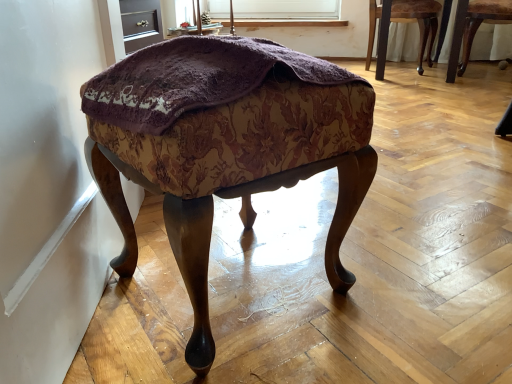
Question: Does wooden chair at upper right, the first chair viewed from the left, have a greater height compared to matte purple fabric at upper center?

Choices:
 (A) no
 (B) yes

Answer: (B)

Question: Considering the relative positions of wooden chair at upper right, the first chair viewed from the left, and matte purple fabric at upper center in the image provided, is wooden chair at upper right, the first chair viewed from the left, in front of matte purple fabric at upper center?

Choices:
 (A) no
 (B) yes

Answer: (B)

Question: From a real-world perspective, is wooden chair at upper right, which is counted as the 2th chair, starting from the right, physically below matte purple fabric at upper center?

Choices:
 (A) yes
 (B) no

Answer: (A)

Question: Is wooden chair at upper right, which is counted as the 2th chair, starting from the right, oriented towards matte purple fabric at upper center?

Choices:
 (A) yes
 (B) no

Answer: (B)

Question: Is wooden chair at upper right, the first chair viewed from the left, positioned with its back to matte purple fabric at upper center?

Choices:
 (A) no
 (B) yes

Answer: (A)

Question: In terms of width, does wooden chair at right, marked as the second chair in a left-to-right arrangement, look wider or thinner when compared to matte purple fabric at upper center?

Choices:
 (A) wide
 (B) thin

Answer: (A)

Question: From the image's perspective, relative to matte purple fabric at upper center, is wooden chair at right, marked as the second chair in a left-to-right arrangement, above or below?

Choices:
 (A) below
 (B) above

Answer: (A)

Question: Is wooden chair at right, arranged as the 1th chair when viewed from the right, bigger or smaller than matte purple fabric at upper center?

Choices:
 (A) big
 (B) small

Answer: (A)

Question: Does point (476, 9) appear closer or farther from the camera than point (188, 28)?

Choices:
 (A) farther
 (B) closer

Answer: (B)

Question: From a real-world perspective, is matte purple fabric at upper center positioned above or below wooden chair at upper right, which is counted as the 2th chair, starting from the right?

Choices:
 (A) below
 (B) above

Answer: (B)

Question: Is matte purple fabric at upper center spatially inside wooden chair at upper right, which is counted as the 2th chair, starting from the right, or outside of it?

Choices:
 (A) outside
 (B) inside

Answer: (A)

Question: Relative to wooden chair at upper right, which is counted as the 2th chair, starting from the right, is matte purple fabric at upper center in front or behind?

Choices:
 (A) front
 (B) behind

Answer: (B)

Question: Based on their sizes in the image, would you say matte purple fabric at upper center is bigger or smaller than wooden chair at upper right, the first chair viewed from the left?

Choices:
 (A) big
 (B) small

Answer: (B)

Question: Considering the positions of wooden chair at right, arranged as the 1th chair when viewed from the right, and wooden chair at upper right, which is counted as the 2th chair, starting from the right, in the image, is wooden chair at right, arranged as the 1th chair when viewed from the right, taller or shorter than wooden chair at upper right, which is counted as the 2th chair, starting from the right,?

Choices:
 (A) short
 (B) tall

Answer: (A)

Question: Looking at their shapes, would you say wooden chair at right, marked as the second chair in a left-to-right arrangement, is wider or thinner than wooden chair at upper right, the first chair viewed from the left?

Choices:
 (A) thin
 (B) wide

Answer: (A)